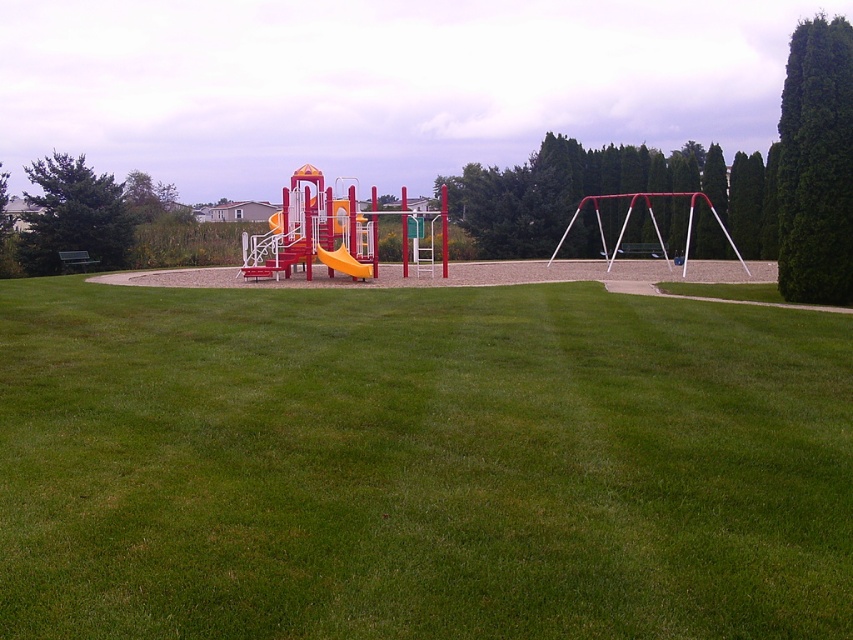
You are a landscape architect designing a new park layout. You need to place a new bench between the green leafy cypress at upper right and the green leafy cypress tree at left. Which cypress tree should the bench be closer to if you want it near the thinner tree?

The bench should be placed closer to the green leafy cypress at upper right because it is thinner than the green leafy cypress tree at left.

You are a landscape architect designing a new playground. You need to ensure that the green leafy cypress at upper right and the orange matte slide at center are visible from the main entrance. Given their sizes, which object might require strategic placement to avoid blocking the view of the other?

The green leafy cypress at upper right has a larger width than the orange matte slide at center, so it might need to be positioned carefully to prevent obstructing the view of the slide.

You are a park visitor who wants to take a photo of the playground with both the green leafy cypress at upper right and the green leafy cypress tree at left in the background. Which cypress tree should you stand closer to in order to include both in your photo?

You should stand closer to the green leafy cypress at upper right because it is shorter than the green leafy cypress tree at left, allowing both to be captured in the frame when positioned nearer to the shorter tree.